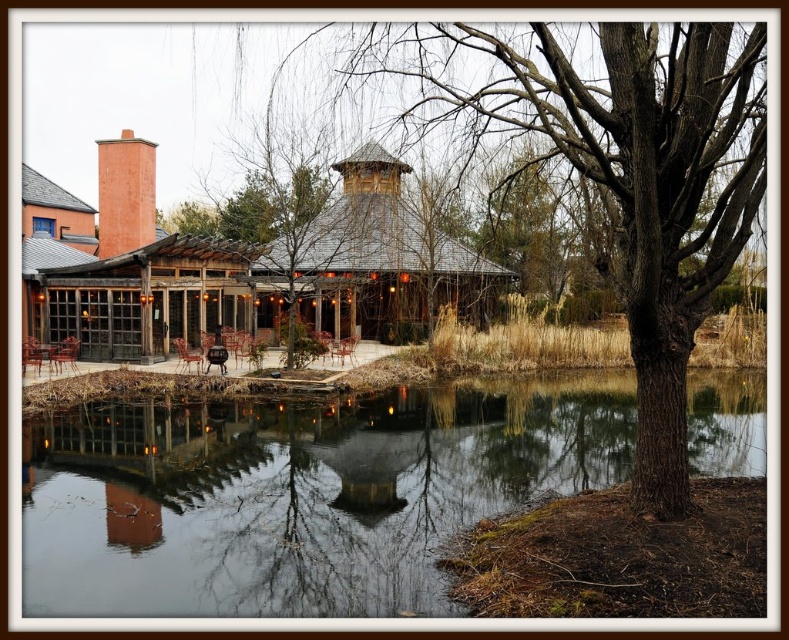
Question: Which point is closer to the camera taking this photo?

Choices:
 (A) (107, 145)
 (B) (582, 92)
 (C) (406, 548)

Answer: (B)

Question: Can you confirm if brown rough bark tree at center is positioned above rustic brick chimney at upper left?

Choices:
 (A) no
 (B) yes

Answer: (A)

Question: Which point is closer to the camera?

Choices:
 (A) (129, 234)
 (B) (713, 237)

Answer: (B)

Question: Based on their relative distances, which object is nearer to the brown rough bark tree at center?

Choices:
 (A) transparent water at center
 (B) rustic brick chimney at upper left

Answer: (A)

Question: Is transparent water at center bigger than brown rough bark tree at center?

Choices:
 (A) yes
 (B) no

Answer: (B)

Question: Does transparent water at center appear over brown rough bark tree at center?

Choices:
 (A) no
 (B) yes

Answer: (A)